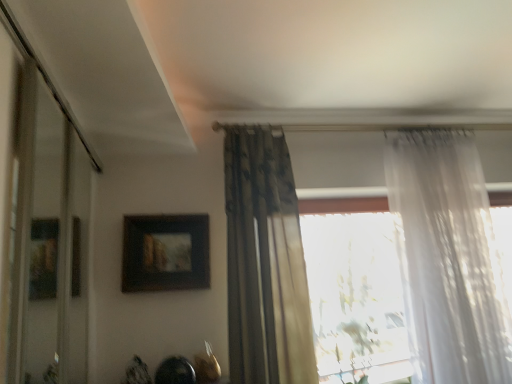
Question: Is sheer white curtain at right, the 2th curtain in the left-to-right sequence, oriented towards dark floral fabric curtain at center, which appears as the first curtain when viewed from the left?

Choices:
 (A) no
 (B) yes

Answer: (A)

Question: From the image's perspective, would you say sheer white curtain at right, marked as the 1th curtain in a right-to-left arrangement, is positioned over dark floral fabric curtain at center, the second curtain positioned from the right?

Choices:
 (A) yes
 (B) no

Answer: (B)

Question: Can you confirm if sheer white curtain at right, marked as the 1th curtain in a right-to-left arrangement, is positioned to the right of dark floral fabric curtain at center, which appears as the first curtain when viewed from the left?

Choices:
 (A) no
 (B) yes

Answer: (B)

Question: Are sheer white curtain at right, the 2th curtain in the left-to-right sequence, and dark floral fabric curtain at center, which appears as the first curtain when viewed from the left, making contact?

Choices:
 (A) no
 (B) yes

Answer: (A)

Question: Is sheer white curtain at right, marked as the 1th curtain in a right-to-left arrangement, positioned beyond the bounds of dark floral fabric curtain at center, which appears as the first curtain when viewed from the left?

Choices:
 (A) yes
 (B) no

Answer: (A)

Question: Is the depth of sheer white curtain at right, the 2th curtain in the left-to-right sequence, less than that of dark floral fabric curtain at center, the second curtain positioned from the right?

Choices:
 (A) yes
 (B) no

Answer: (B)

Question: Is matte black picture frame at upper center thinner than transparent glass door at left?

Choices:
 (A) no
 (B) yes

Answer: (A)

Question: Is matte black picture frame at upper center far from transparent glass door at left?

Choices:
 (A) yes
 (B) no

Answer: (B)

Question: Is matte black picture frame at upper center outside transparent glass door at left?

Choices:
 (A) no
 (B) yes

Answer: (B)

Question: From a real-world perspective, is matte black picture frame at upper center beneath transparent glass door at left?

Choices:
 (A) yes
 (B) no

Answer: (B)

Question: Is the depth of matte black picture frame at upper center greater than that of transparent glass door at left?

Choices:
 (A) yes
 (B) no

Answer: (A)

Question: Considering the relative sizes of matte black picture frame at upper center and transparent glass door at left in the image provided, is matte black picture frame at upper center smaller than transparent glass door at left?

Choices:
 (A) no
 (B) yes

Answer: (B)

Question: From the image's perspective, is transparent glass door at left over dark floral fabric curtain at center, the second curtain positioned from the right?

Choices:
 (A) yes
 (B) no

Answer: (A)